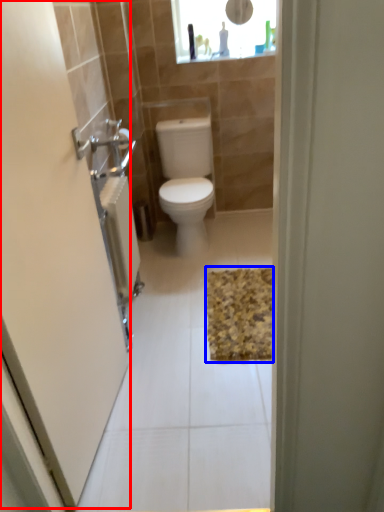
Question: Which object is closer to the camera taking this photo, screen door (highlighted by a red box) or bath mat (highlighted by a blue box)?

Choices:
 (A) screen door
 (B) bath mat

Answer: (A)